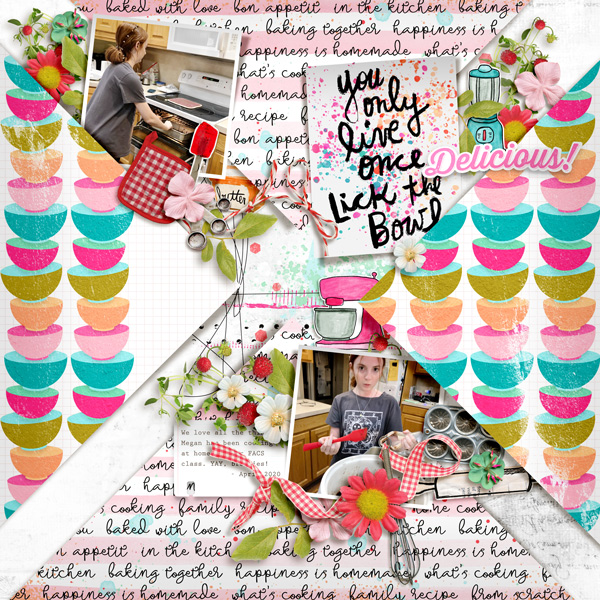
Where is `blue bowls`? The width and height of the screenshot is (600, 600). blue bowls is located at coordinates (505, 367), (458, 376), (547, 371).